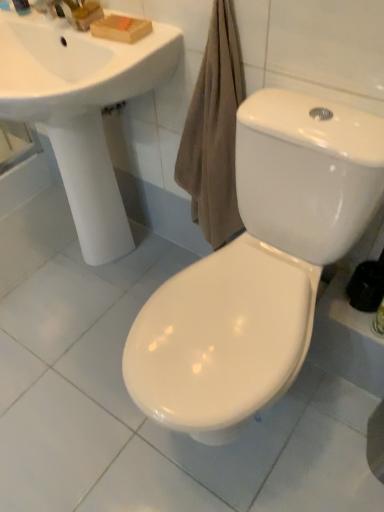
Measure the distance between point (20, 2) and camera.

Point (20, 2) is 3.79 feet away from camera.

What do you see at coordinates (81, 110) in the screenshot? The height and width of the screenshot is (512, 384). I see `white glossy sink at upper left` at bounding box center [81, 110].

The image size is (384, 512). What do you see at coordinates (258, 268) in the screenshot?
I see `white glossy toilet at center` at bounding box center [258, 268].

I want to click on matte plastic soap at upper left, so click(x=21, y=7).

Which object is positioned more to the left, matte plastic soap at upper left or white glossy toilet at center?

From the viewer's perspective, matte plastic soap at upper left appears more on the left side.

The image size is (384, 512). Identify the location of toiletry on the left side of white glossy toilet at center. (21, 7).

From the image's perspective, is white glossy sink at upper left below matte plastic soap at upper left?

Yes.

Is white glossy sink at upper left not close to matte plastic soap at upper left?

No, white glossy sink at upper left is not far away from matte plastic soap at upper left.

How many degrees apart are the facing directions of white glossy sink at upper left and matte plastic soap at upper left?

7.24 degrees.

From a real-world perspective, who is located lower, white glossy sink at upper left or matte plastic soap at upper left?

From a 3D spatial view, white glossy sink at upper left is below.

Looking at their sizes, would you say white glossy toilet at center is wider or thinner than white glossy sink at upper left?

In the image, white glossy toilet at center appears to be wider than white glossy sink at upper left.

Is white glossy toilet at center positioned with its back to white glossy sink at upper left?

No, white glossy sink at upper left is not at the back of white glossy toilet at center.

The height and width of the screenshot is (512, 384). I want to click on sink that appears above the white glossy toilet at center (from a real-world perspective), so click(x=81, y=110).

Is white glossy toilet at center closer to camera compared to white glossy sink at upper left?

Yes, white glossy toilet at center is closer to the viewer.

Looking at this image, from a real-world perspective, between white glossy sink at upper left and white glossy toilet at center, who is vertically lower?

In real-world perspective, white glossy toilet at center is lower.

Is white glossy sink at upper left looking in the opposite direction of white glossy toilet at center?

That's not correct — white glossy sink at upper left is not looking away from white glossy toilet at center.

Are white glossy sink at upper left and white glossy toilet at center located far from each other?

No.

Does point (69, 155) lie in front of point (274, 239)?

No.

Does matte plastic soap at upper left have a lesser height compared to white glossy sink at upper left?

Indeed, matte plastic soap at upper left has a lesser height compared to white glossy sink at upper left.

From a real-world perspective, between matte plastic soap at upper left and white glossy sink at upper left, who is vertically lower?

white glossy sink at upper left, from a real-world perspective.

Can you tell me how much matte plastic soap at upper left and white glossy sink at upper left differ in facing direction?

There is a 7.24-degree angle between the facing directions of matte plastic soap at upper left and white glossy sink at upper left.

Between white glossy toilet at center and matte plastic soap at upper left, which one appears on the right side from the viewer's perspective?

white glossy toilet at center is more to the right.

Does white glossy toilet at center lie in front of matte plastic soap at upper left?

Yes, white glossy toilet at center is closer to the camera.

Is white glossy toilet at center oriented towards matte plastic soap at upper left?

No, white glossy toilet at center is not facing towards matte plastic soap at upper left.

From a real-world perspective, is white glossy toilet at center physically located above or below matte plastic soap at upper left?

From a real-world perspective, white glossy toilet at center is physically below matte plastic soap at upper left.

The image size is (384, 512). Find the location of `toiletry located above the white glossy toilet at center (from the image's perspective)`. toiletry located above the white glossy toilet at center (from the image's perspective) is located at coordinates (21, 7).

The width and height of the screenshot is (384, 512). What are the coordinates of `toiletry above the white glossy sink at upper left (from a real-world perspective)` in the screenshot? It's located at [21, 7].

Considering their positions, is matte plastic soap at upper left positioned further to white glossy toilet at center than white glossy sink at upper left?

Based on the image, matte plastic soap at upper left appears to be further to white glossy toilet at center.

Considering their positions, is white glossy toilet at center positioned further to white glossy sink at upper left than matte plastic soap at upper left?

white glossy toilet at center.

Based on the photo, which object lies nearer to the anchor point white glossy sink at upper left, matte plastic soap at upper left or white glossy toilet at center?

matte plastic soap at upper left lies closer to white glossy sink at upper left than the other object.

In the scene shown: Estimate the real-world distances between objects in this image. Which object is closer to matte plastic soap at upper left, white glossy sink at upper left or white glossy toilet at center?

white glossy sink at upper left is positioned closer to the anchor matte plastic soap at upper left.

Looking at the image, which one is located closer to matte plastic soap at upper left, white glossy toilet at center or white glossy sink at upper left?

white glossy sink at upper left.

Based on their spatial positions, is white glossy sink at upper left or matte plastic soap at upper left further from white glossy toilet at center?

matte plastic soap at upper left is positioned further to the anchor white glossy toilet at center.

Find the location of a particular element. This screenshot has height=512, width=384. sink between matte plastic soap at upper left and white glossy toilet at center vertically is located at coordinates (81, 110).